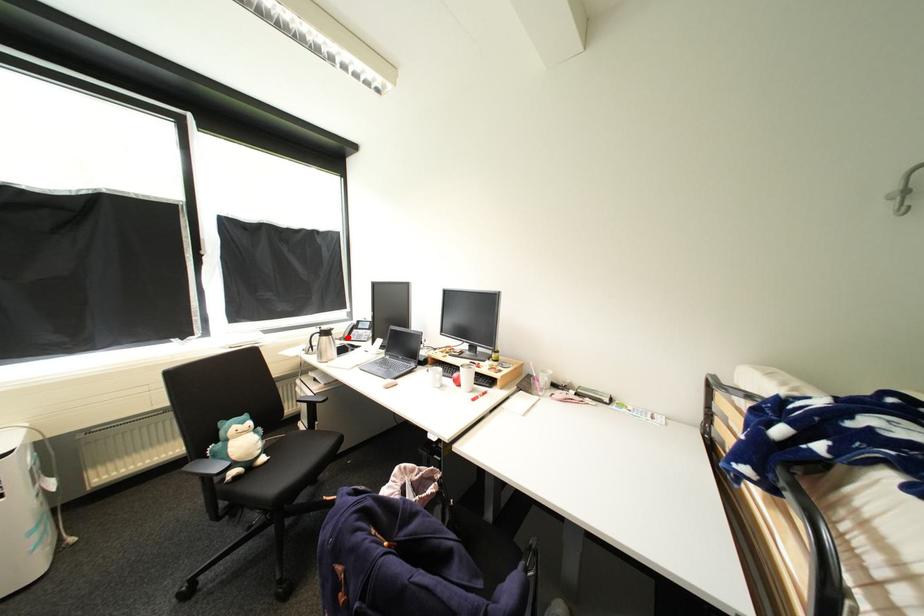
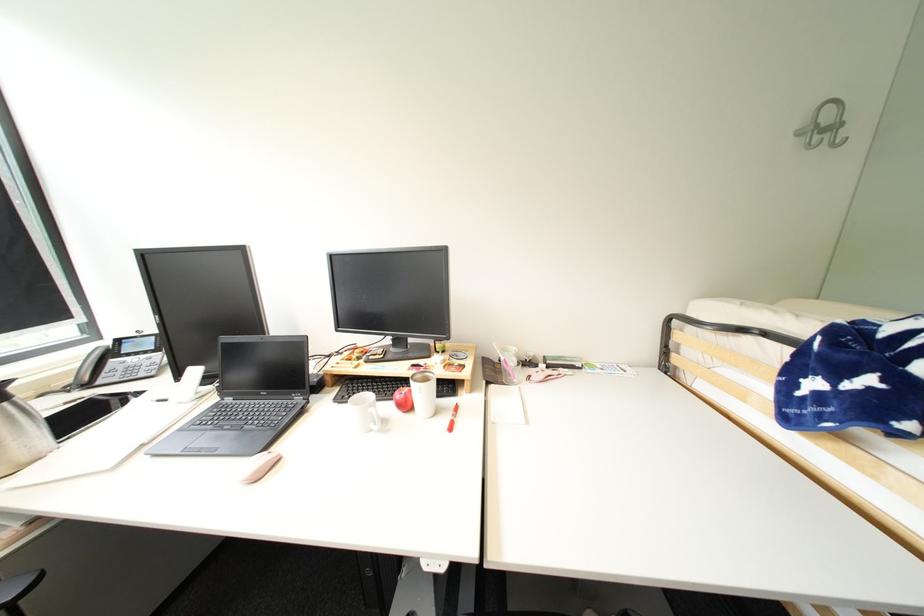
Locate, in the second image, the point that corresponds to the highlighted location in the first image.

(75, 384)